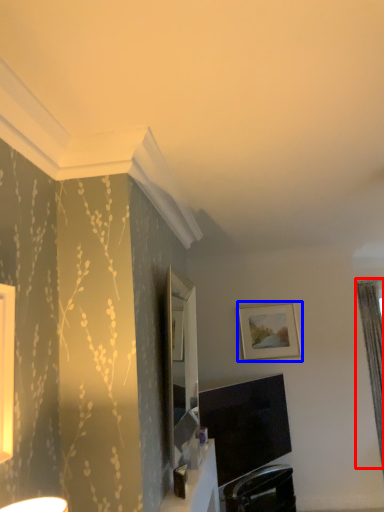
Question: Among these objects, which one is farthest to the camera, curtain (highlighted by a red box) or picture frame (highlighted by a blue box)?

Choices:
 (A) curtain
 (B) picture frame

Answer: (A)